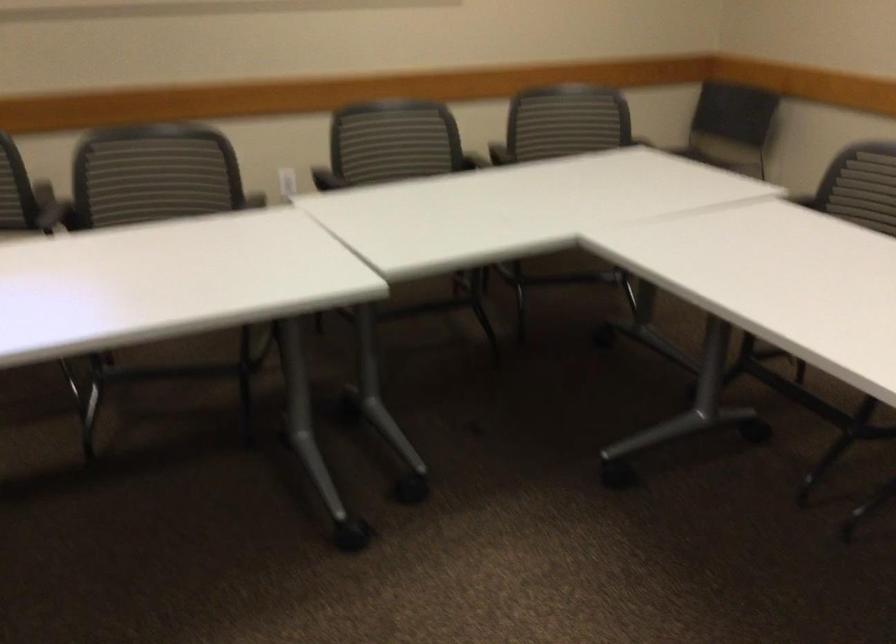
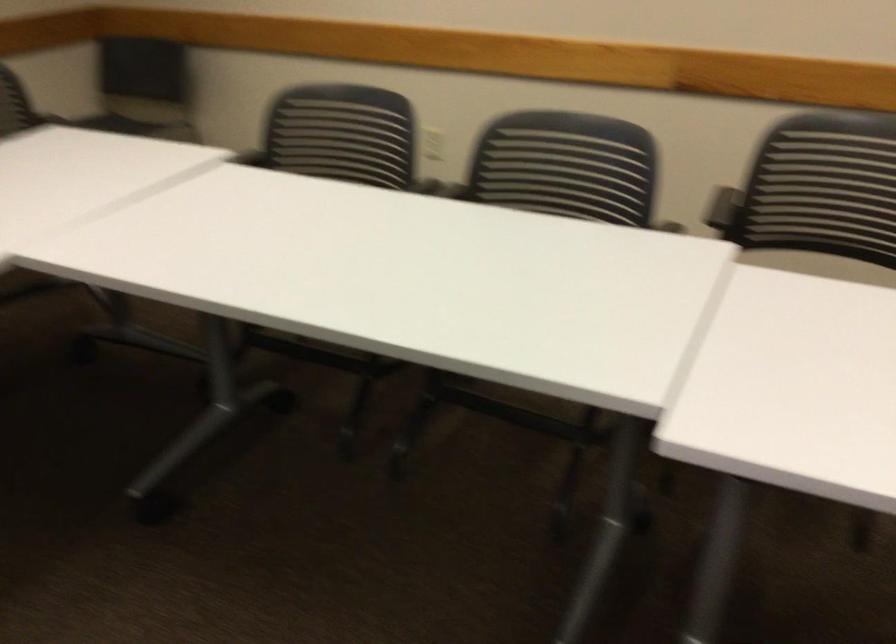
Question: The camera is either moving clockwise (left) or counter-clockwise (right) around the object. The first image is from the beginning of the video and the second image is from the end. Is the camera moving left or right when shooting the video?

Choices:
 (A) Left
 (B) Right

Answer: (A)